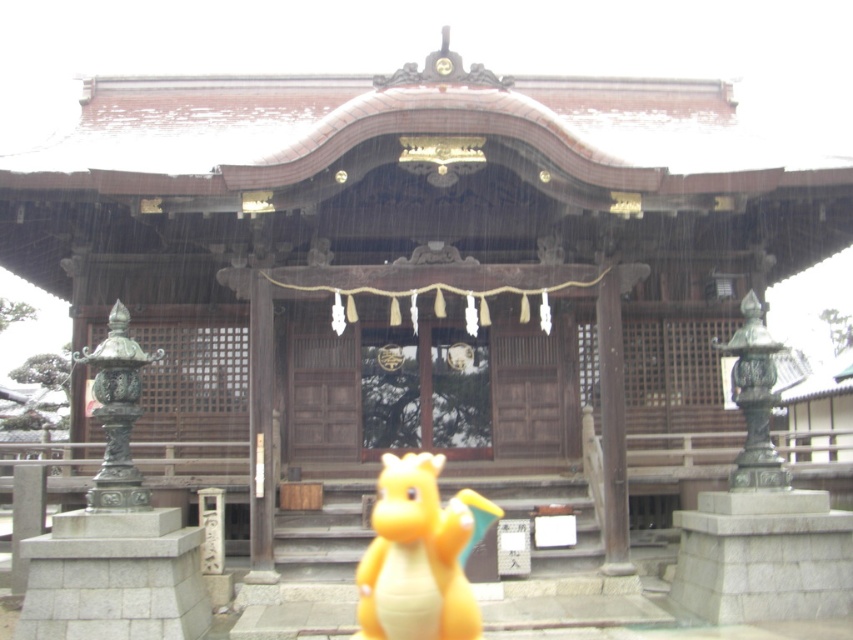
Question: Which of the following is the farthest from the observer?

Choices:
 (A) (393, 595)
 (B) (119, 500)

Answer: (B)

Question: Observing the image, what is the correct spatial positioning of yellow matte toy dragon at center in reference to bronze statue at left?

Choices:
 (A) below
 (B) above

Answer: (A)

Question: Can you confirm if yellow matte toy dragon at center is positioned to the right of bronze statue at left?

Choices:
 (A) yes
 (B) no

Answer: (A)

Question: From the image, what is the correct spatial relationship of yellow matte toy dragon at center in relation to bronze statue at left?

Choices:
 (A) left
 (B) right

Answer: (B)